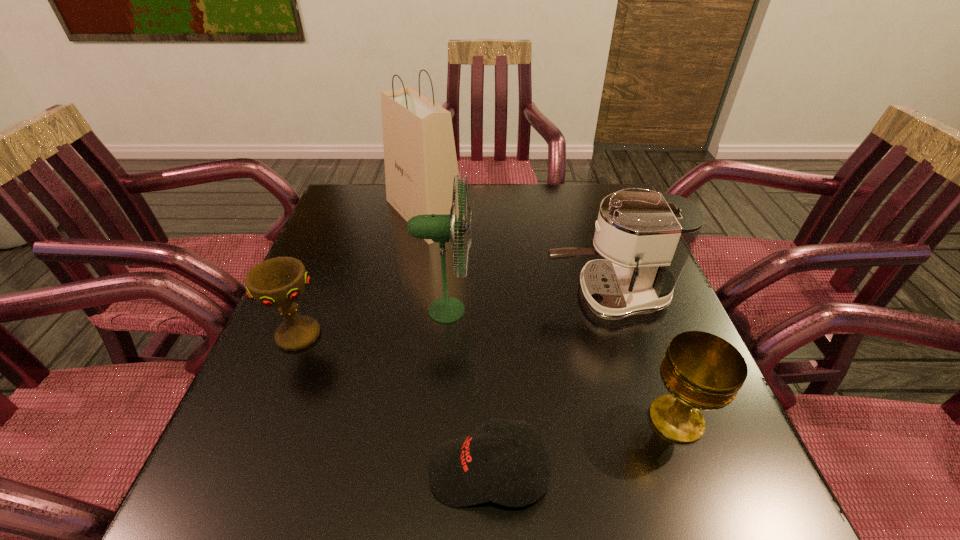
Where is `the farthest object`? This screenshot has height=540, width=960. the farthest object is located at coordinates (420, 159).

Image resolution: width=960 pixels, height=540 pixels. Identify the location of shopping bag. (420, 159).

Where is `the second tallest object`? Image resolution: width=960 pixels, height=540 pixels. the second tallest object is located at coordinates (440, 228).

Locate an element on the screen. the fourth shortest object is located at coordinates (646, 237).

Identify the location of the left chalice. (279, 282).

You are a GUI agent. You are given a task and a screenshot of the screen. Output one action in this format:
    pyautogui.click(x=<x>, y=<y>)
    Task: Click on the leftmost object
    The image size is (960, 540).
    Given the screenshot: What is the action you would take?
    pyautogui.click(x=279, y=282)

The width and height of the screenshot is (960, 540). I want to click on the nearer chalice, so click(701, 371).

At what (x,y) coordinates should I click in order to perform the action: click on baseball cap. Please return your answer as a coordinate pair (x, y). The height and width of the screenshot is (540, 960). Looking at the image, I should click on (459, 475).

In order to click on vacant space situated on the right of the tallest object in this screenshot , I will do `click(564, 214)`.

Identify the location of vacant space located 0.230m on the front-facing side of the fan. This screenshot has width=960, height=540. (573, 310).